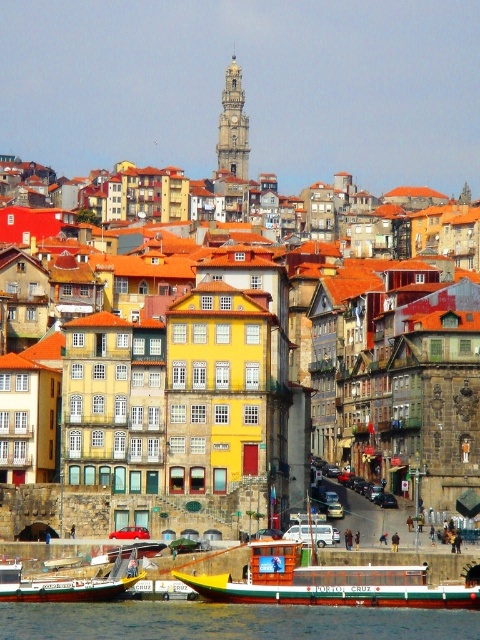
Can you confirm if yellow stone building at center is bigger than wooden boat at lower left?

Indeed, yellow stone building at center has a larger size compared to wooden boat at lower left.

Who is higher up, yellow stone building at center or wooden boat at lower left?

yellow stone building at center is above.

Find the location of `yellow stone building at center`. yellow stone building at center is located at coordinates (243, 397).

Where is `yellow stone building at center`? yellow stone building at center is located at coordinates (243, 397).

What do you see at coordinates (243, 397) in the screenshot? I see `yellow stone building at center` at bounding box center [243, 397].

Is yellow stone building at center behind wooden polished boat at lower center?

Yes, it is.

The image size is (480, 640). Describe the element at coordinates (243, 397) in the screenshot. I see `yellow stone building at center` at that location.

Where is `yellow stone building at center`? This screenshot has width=480, height=640. yellow stone building at center is located at coordinates (243, 397).

Between point (240, 634) and point (273, 588), which one is positioned behind?

Point (273, 588)

Between transparent water at lower center and wooden polished boat at lower center, which one has less height?

transparent water at lower center is shorter.

Locate an element on the screen. transparent water at lower center is located at coordinates (229, 621).